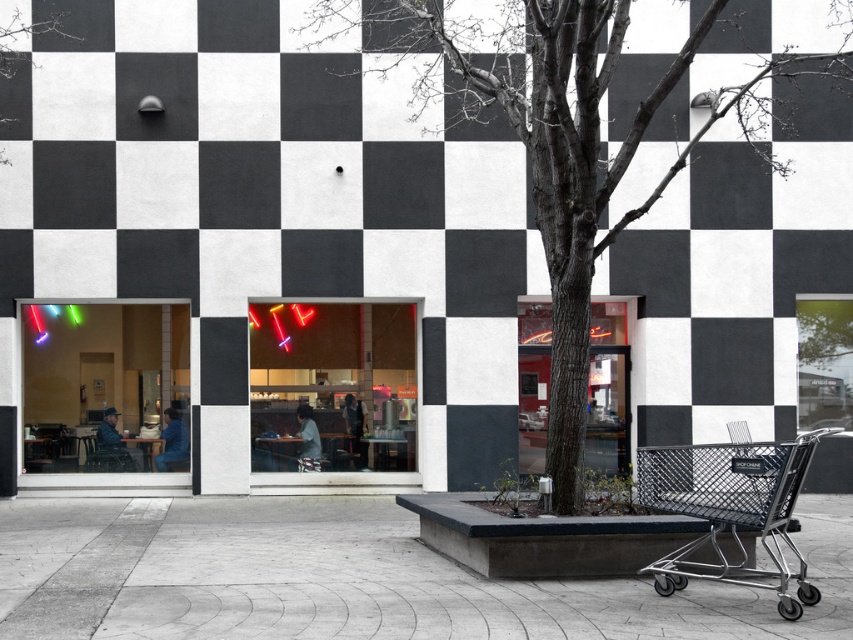
Question: Does concrete at center have a smaller size compared to metallic silver shopping cart at lower right?

Choices:
 (A) no
 (B) yes

Answer: (A)

Question: Among these points, which one is farthest from the camera?

Choices:
 (A) (767, 97)
 (B) (762, 586)
 (C) (547, 593)

Answer: (A)

Question: Among these points, which one is farthest from the camera?

Choices:
 (A) (831, 83)
 (B) (1, 611)
 (C) (717, 532)

Answer: (A)

Question: Which point is farther to the camera?

Choices:
 (A) metallic silver shopping cart at lower right
 (B) concrete at center
 (C) dark brown bark tree at center

Answer: (C)

Question: Is concrete at center to the left of metallic silver shopping cart at lower right from the viewer's perspective?

Choices:
 (A) no
 (B) yes

Answer: (B)

Question: Can you confirm if concrete at center is smaller than dark brown bark tree at center?

Choices:
 (A) yes
 (B) no

Answer: (A)